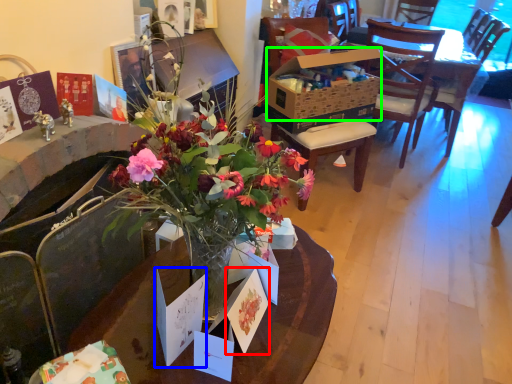
Question: Which is farther away from postcard (highlighted by a red box)? postcard (highlighted by a blue box) or box (highlighted by a green box)?

Choices:
 (A) postcard
 (B) box

Answer: (B)